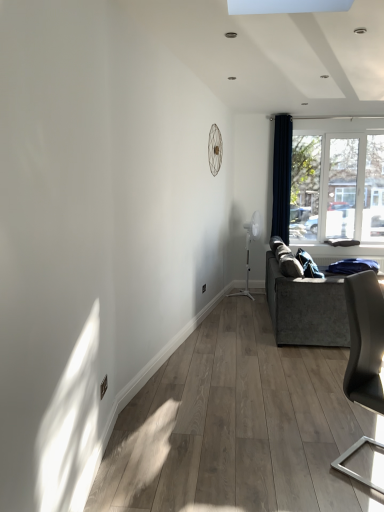
At what (x,y) coordinates should I click in order to perform the action: click on velvet grey couch at right. Please return your answer as a coordinate pair (x, y). The width and height of the screenshot is (384, 512). Looking at the image, I should click on (306, 308).

The height and width of the screenshot is (512, 384). What do you see at coordinates (365, 341) in the screenshot? I see `matte gray chair at right` at bounding box center [365, 341].

What do you see at coordinates (282, 176) in the screenshot? This screenshot has width=384, height=512. I see `navy blue velvet curtain at right` at bounding box center [282, 176].

The image size is (384, 512). In order to click on velvet grey couch at right in this screenshot , I will do `click(306, 308)`.

In the scene shown: Which is more to the right, velvet grey couch at right or white plastic window at right?

white plastic window at right.

From a real-world perspective, who is located higher, velvet grey couch at right or white plastic window at right?

From a 3D spatial view, white plastic window at right is above.

Looking at this image, is velvet grey couch at right positioned far away from white plastic window at right?

Yes, velvet grey couch at right and white plastic window at right are located far from each other.

How far apart are velvet grey couch at right and white plastic window at right?

A distance of 7.17 feet exists between velvet grey couch at right and white plastic window at right.

Is velvet grey couch at right next to navy blue velvet curtain at right and touching it?

No, velvet grey couch at right is not beside navy blue velvet curtain at right.

Is velvet grey couch at right oriented away from navy blue velvet curtain at right?

velvet grey couch at right does not have its back to navy blue velvet curtain at right.

How far apart are velvet grey couch at right and navy blue velvet curtain at right?

They are 6.96 feet apart.

Considering the sizes of objects velvet grey couch at right and navy blue velvet curtain at right in the image provided, who is thinner, velvet grey couch at right or navy blue velvet curtain at right?

With smaller width is navy blue velvet curtain at right.

Which object is further away from the camera taking this photo, velvet grey couch at right or matte gray chair at right?

Positioned behind is velvet grey couch at right.

Which is behind, point (288, 328) or point (381, 326)?

Point (288, 328)

Considering the relative sizes of velvet grey couch at right and matte gray chair at right in the image provided, is velvet grey couch at right smaller than matte gray chair at right?

Incorrect, velvet grey couch at right is not smaller in size than matte gray chair at right.

Is velvet grey couch at right shorter than matte gray chair at right?

Indeed, velvet grey couch at right has a lesser height compared to matte gray chair at right.

Is matte gray chair at right surrounding white plastic window at right?

No, white plastic window at right is not inside matte gray chair at right.

Which point is more forward, [358,371] or [349,150]?

The point [358,371] is closer to the camera.

Where is `window positioned vertically above the matte gray chair at right (from a real-world perspective)`? window positioned vertically above the matte gray chair at right (from a real-world perspective) is located at coordinates (337, 180).

Is navy blue velvet curtain at right in contact with white plastic window at right?

navy blue velvet curtain at right and white plastic window at right are not in contact.

From the image's perspective, is navy blue velvet curtain at right located above white plastic window at right?

Yes, from the image's perspective, navy blue velvet curtain at right is over white plastic window at right.

How much distance is there between navy blue velvet curtain at right and white plastic window at right?

21.81 inches.

In terms of height, does navy blue velvet curtain at right look taller or shorter compared to white plastic window at right?

Considering their sizes, navy blue velvet curtain at right has more height than white plastic window at right.

Is navy blue velvet curtain at right in contact with velvet grey couch at right?

No, navy blue velvet curtain at right is not touching velvet grey couch at right.

In terms of size, does navy blue velvet curtain at right appear bigger or smaller than velvet grey couch at right?

navy blue velvet curtain at right is smaller than velvet grey couch at right.

From the image's perspective, is navy blue velvet curtain at right located above velvet grey couch at right?

Correct, navy blue velvet curtain at right appears higher than velvet grey couch at right in the image.

Locate an element on the screen. Image resolution: width=384 pixels, height=512 pixels. chair below the navy blue velvet curtain at right (from the image's perspective) is located at coordinates (365, 341).

Would you consider navy blue velvet curtain at right to be distant from matte gray chair at right?

navy blue velvet curtain at right is far away from matte gray chair at right.

Is navy blue velvet curtain at right oriented towards matte gray chair at right?

Yes, navy blue velvet curtain at right is facing matte gray chair at right.

The width and height of the screenshot is (384, 512). Find the location of `studio couch below the white plastic window at right (from the image's perspective)`. studio couch below the white plastic window at right (from the image's perspective) is located at coordinates (306, 308).

Identify the location of curtain on the left side of velvet grey couch at right. This screenshot has height=512, width=384. (282, 176).

From the image, which object appears to be nearer to matte gray chair at right, velvet grey couch at right or navy blue velvet curtain at right?

Based on the image, velvet grey couch at right appears to be nearer to matte gray chair at right.

Based on their spatial positions, is matte gray chair at right or velvet grey couch at right further from navy blue velvet curtain at right?

The object further to navy blue velvet curtain at right is matte gray chair at right.

Looking at the image, which one is located closer to navy blue velvet curtain at right, velvet grey couch at right or white plastic window at right?

The object closer to navy blue velvet curtain at right is white plastic window at right.

From the image, which object appears to be farther from white plastic window at right, navy blue velvet curtain at right or matte gray chair at right?

matte gray chair at right.

Looking at the image, which one is located closer to navy blue velvet curtain at right, matte gray chair at right or white plastic window at right?

white plastic window at right is positioned closer to the anchor navy blue velvet curtain at right.

Considering their positions, is matte gray chair at right positioned closer to white plastic window at right than velvet grey couch at right?

velvet grey couch at right is positioned closer to the anchor white plastic window at right.

When comparing their distances from velvet grey couch at right, does matte gray chair at right or navy blue velvet curtain at right seem further?

The object further to velvet grey couch at right is navy blue velvet curtain at right.

When comparing their distances from matte gray chair at right, does white plastic window at right or navy blue velvet curtain at right seem closer?

The object closer to matte gray chair at right is navy blue velvet curtain at right.

Identify the location of studio couch positioned between matte gray chair at right and navy blue velvet curtain at right from near to far. Image resolution: width=384 pixels, height=512 pixels. (306, 308).

Image resolution: width=384 pixels, height=512 pixels. I want to click on curtain located between velvet grey couch at right and white plastic window at right in the depth direction, so click(282, 176).

Locate an element on the screen. The image size is (384, 512). curtain between matte gray chair at right and white plastic window at right along the z-axis is located at coordinates (282, 176).

Locate an element on the screen. The height and width of the screenshot is (512, 384). studio couch between matte gray chair at right and white plastic window at right along the z-axis is located at coordinates (306, 308).